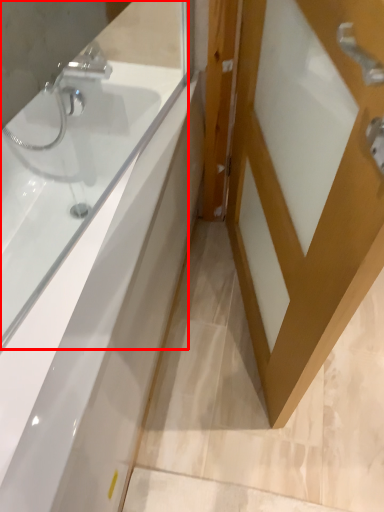
Question: From the image's perspective, where is bathtub (annotated by the red box) located relative to door?

Choices:
 (A) above
 (B) below

Answer: (B)